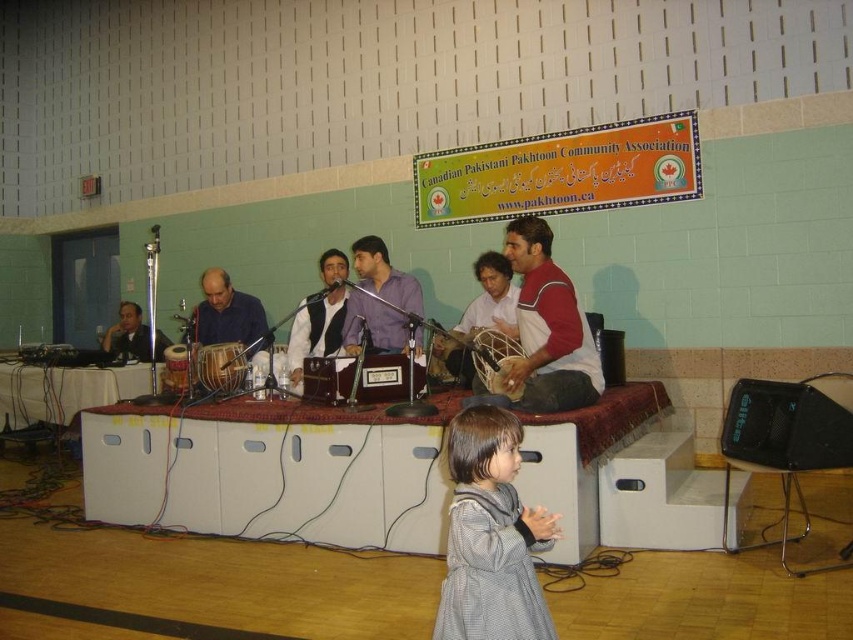
You are sitting in the audience facing the stage and see two points marked on the floor. The first point is at coordinates point [457,566] and the second is at point [494,342]. Which point is closer to you?

The point at point [457,566] is closer to you than the point at point [494,342].

You are an event organizer standing at the back of the stage. You need to place a decorative banner between the point at position (x=485, y=538) and the point at position (x=408, y=307). Which point should the banner be closer to if you want it to be nearer to the front of the stage?

The banner should be closer to point (x=485, y=538) because it is in front of point (x=408, y=307), making it closer to the front of the stage.